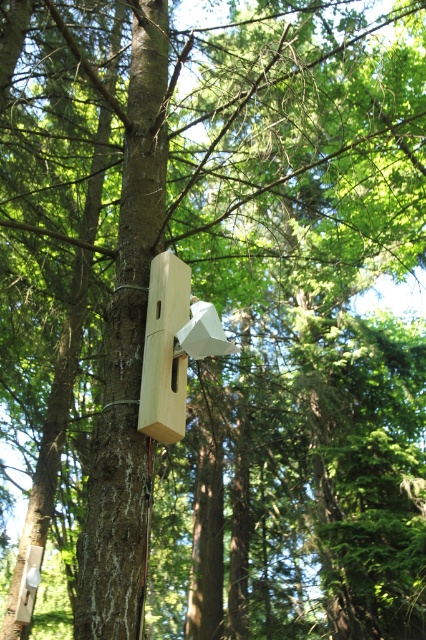
Based on the coordinates provided, which object in the scene is located at point (126, 353)?

The point (126, 353) indicates the smooth brown tree trunk at center.

From the picture: You are a researcher studying tree bark patterns. You have a camera with a zoom lens and want to photograph the smooth brown tree trunk at center. Where should you point your camera to capture it?

You should point your camera to the coordinates point at point (126, 353) to capture the smooth brown tree trunk at center.